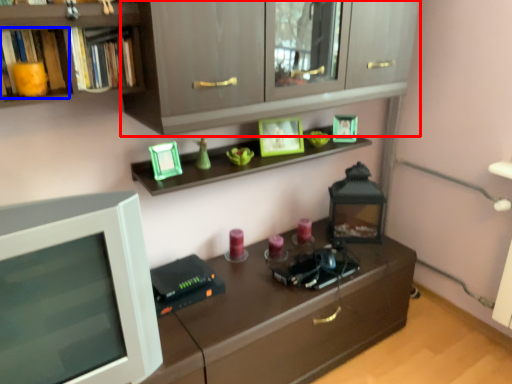
Question: Which point is closer to the camera, cabinetry (highlighted by a red box) or book (highlighted by a blue box)?

Choices:
 (A) cabinetry
 (B) book

Answer: (A)